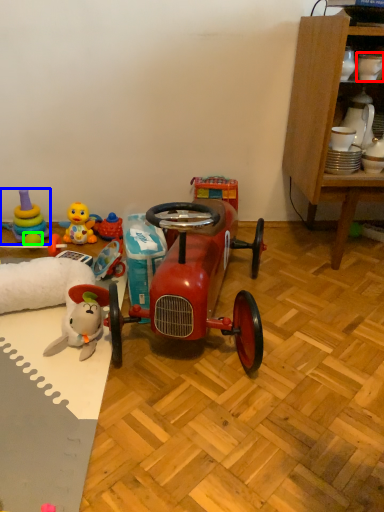
Question: Estimate the real-world distances between objects in this image. Which object is farther from toy (highlighted by a red box), toy (highlighted by a blue box) or toy (highlighted by a green box)?

Choices:
 (A) toy
 (B) toy

Answer: (A)